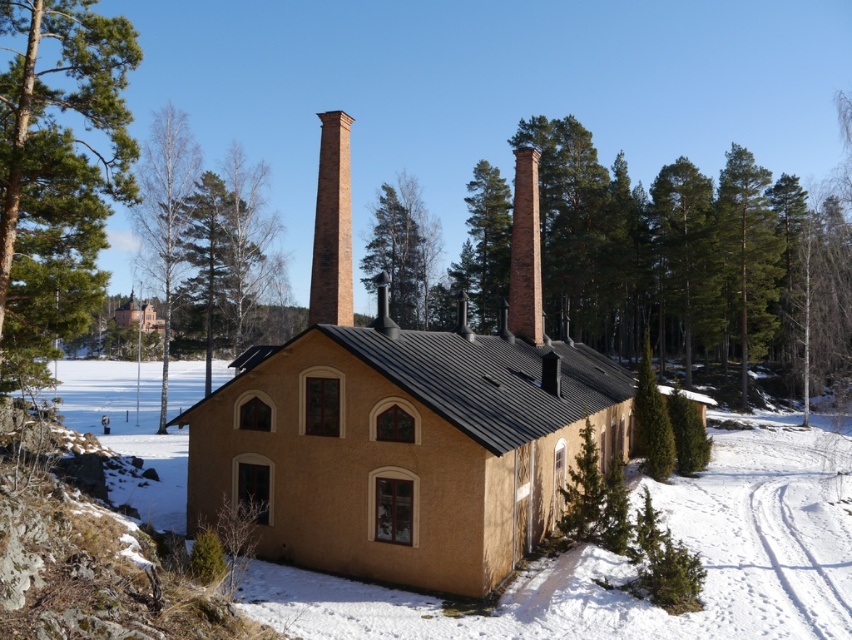
You are standing at the base of the brick chimney at center and want to walk to the green textured tree at right. Given that the average human walking speed is 3 miles per hour, how many minutes would it take to reach the tree?

The green textured tree at right is 146.52 feet from brick chimney at center. Converting feet to miles, 146.52 feet is approximately 0.0278 miles. At 3 miles per hour, the time required would be distance divided by speed, so 0.0278 miles divided by 3 mph equals approximately 0.00927 hours. Converting hours to minutes by multiplying by 60 gives roughly 0.556 minutes, which is about 33.4 seconds. Therefore, it would take approximately 0.556 minutes to reach the tree.